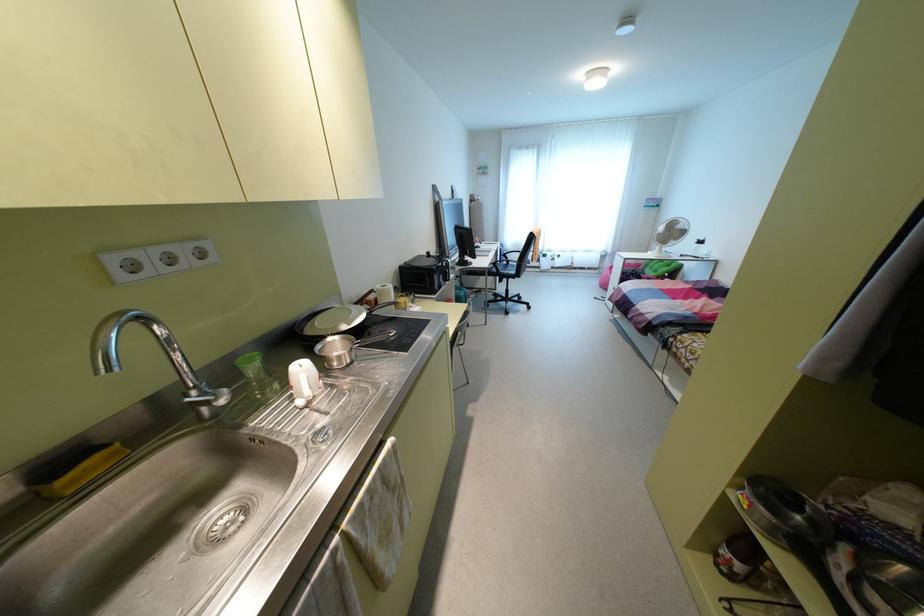
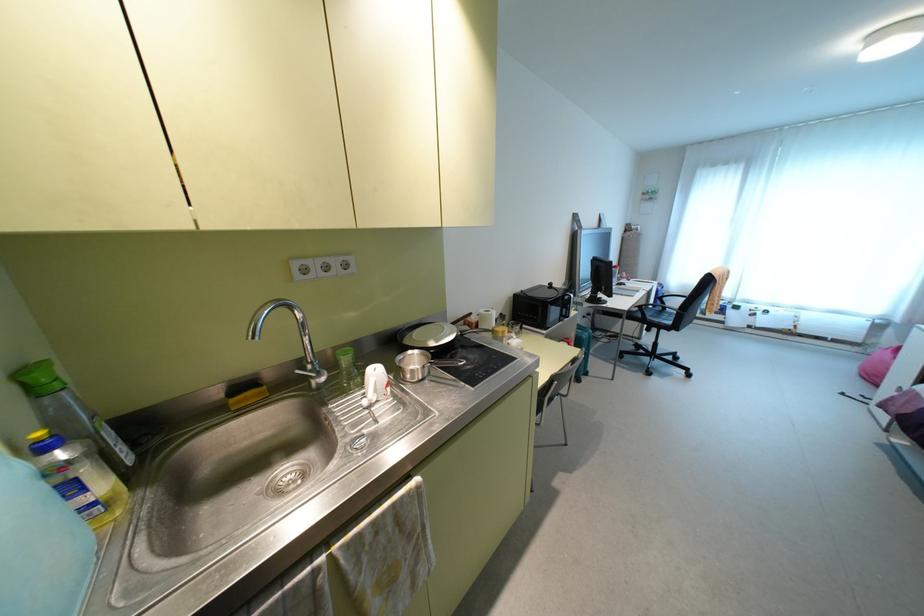
In the second image, find the point that corresponds to point 348,323 in the first image.

(435, 341)